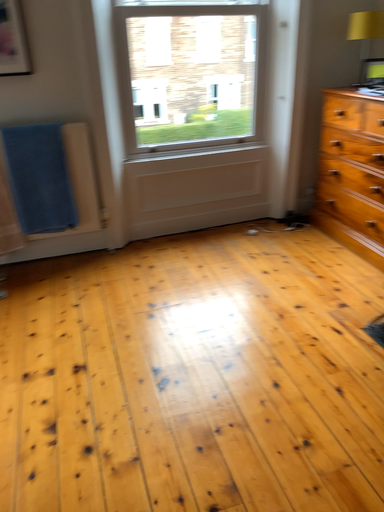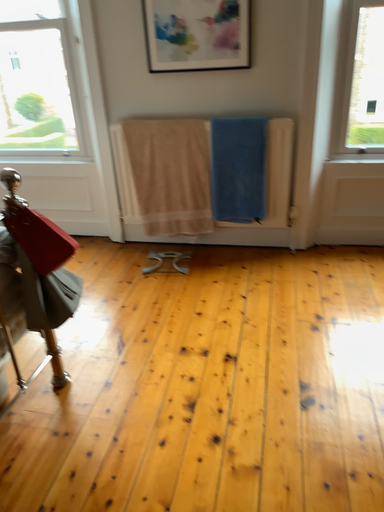
Question: How did the camera likely rotate when shooting the video?

Choices:
 (A) rotated left
 (B) rotated right

Answer: (A)